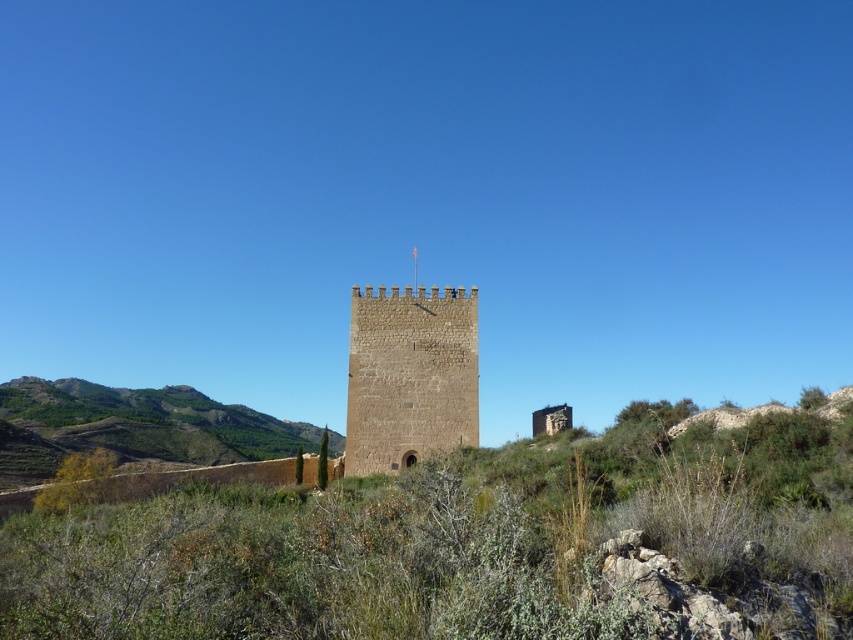
Question: Which object is positioned closest to the green shrubs at center?

Choices:
 (A) brown stone tower at center
 (B) green grassy hillside at lower left

Answer: (A)

Question: Can you confirm if green shrubs at center is thinner than green grassy hillside at lower left?

Choices:
 (A) yes
 (B) no

Answer: (B)

Question: Is green shrubs at center thinner than brown stone tower at center?

Choices:
 (A) yes
 (B) no

Answer: (B)

Question: Estimate the real-world distances between objects in this image. Which object is farther from the green grassy hillside at lower left?

Choices:
 (A) brown stone tower at center
 (B) green shrubs at center

Answer: (B)

Question: Which of these objects is positioned farthest from the brown stone tower at center?

Choices:
 (A) green shrubs at center
 (B) green grassy hillside at lower left

Answer: (B)

Question: Considering the relative positions of green shrubs at center and brown stone tower at center in the image provided, where is green shrubs at center located with respect to brown stone tower at center?

Choices:
 (A) below
 (B) above

Answer: (A)